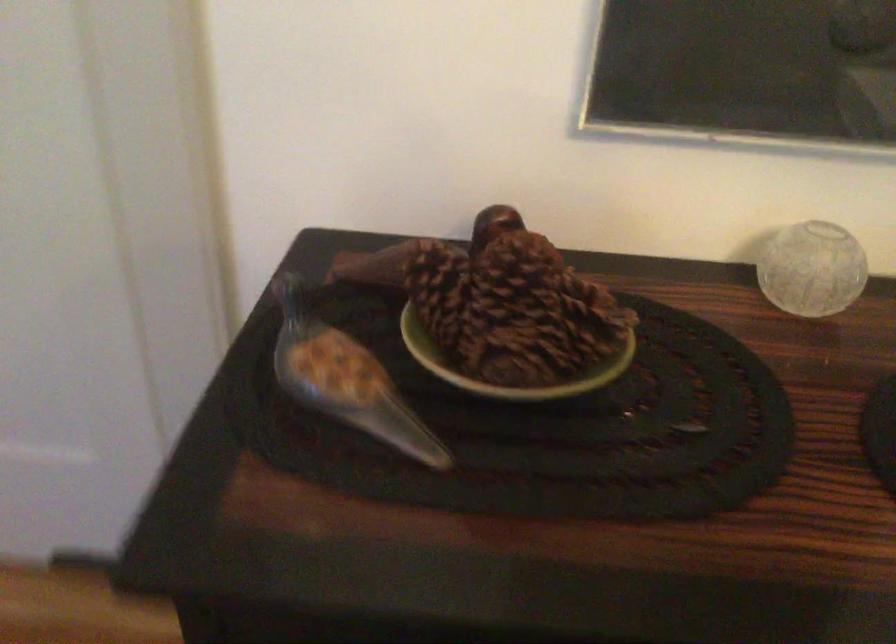
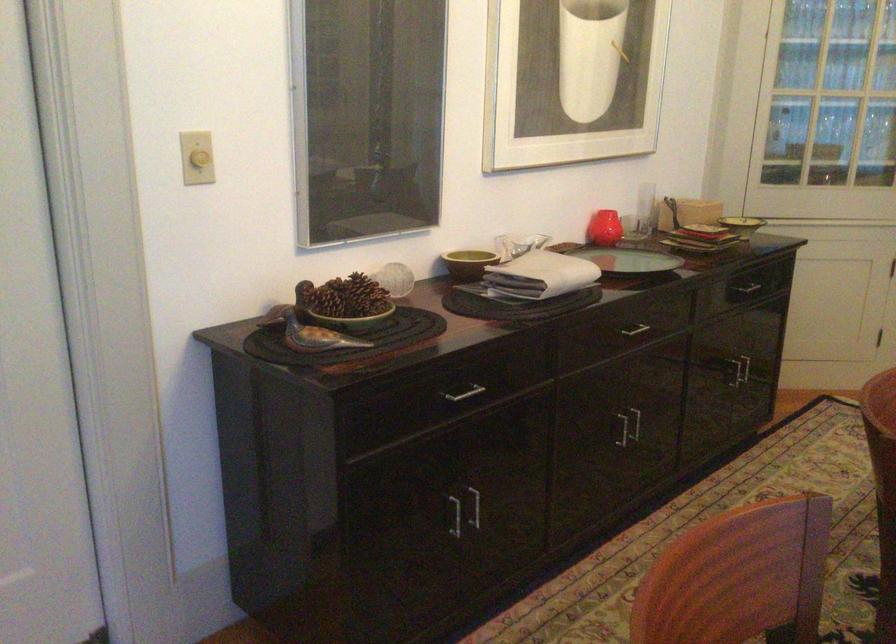
Locate, in the second image, the point that corresponds to pixel 369 383 in the first image.

(312, 333)